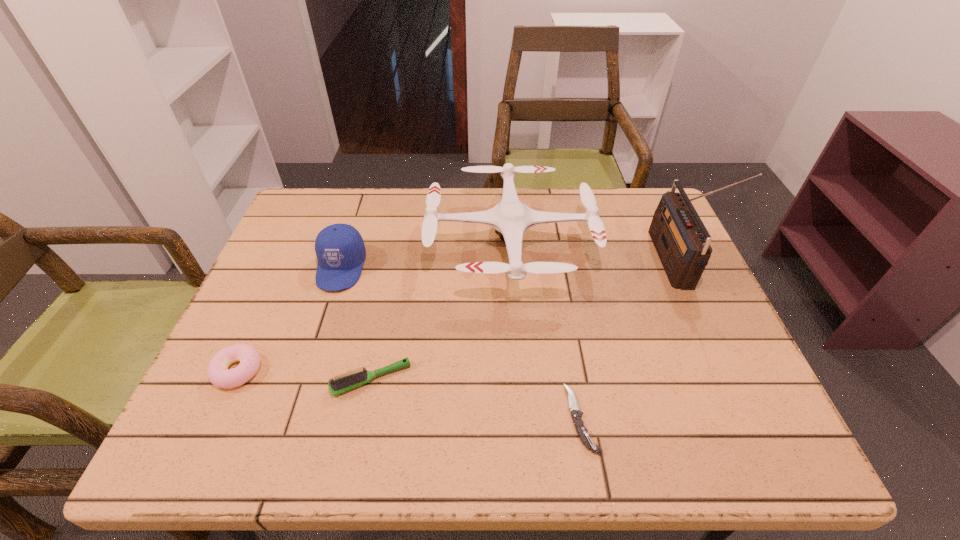
The image size is (960, 540). I want to click on object that is the closest one to the hairbrush, so click(218, 373).

Identify which object is the second closest to the rightmost object. Please provide its 2D coordinates. Your answer should be formatted as a tuple, i.e. [(x, y)], where the tuple contains the x and y coordinates of a point satisfying the conditions above.

[(582, 432)]

This screenshot has width=960, height=540. I want to click on blank space that satisfies the following two spatial constraints: 1. with the camera attached at the bottom of the drone; 2. on the front-facing side of the fourth shortest object, so click(512, 268).

Where is `blank space that satisfies the following two spatial constraints: 1. on the front-facing side of the tallest object; 2. on the front-facing side of the cap`? blank space that satisfies the following two spatial constraints: 1. on the front-facing side of the tallest object; 2. on the front-facing side of the cap is located at coordinates (674, 268).

Locate an element on the screen. free space in the image that satisfies the following two spatial constraints: 1. on the front-facing side of the radio receiver; 2. on the front-facing side of the cap is located at coordinates (674, 268).

Identify the location of free space in the image that satisfies the following two spatial constraints: 1. on the front-facing side of the rightmost object; 2. on the front side of the hairbrush. (724, 379).